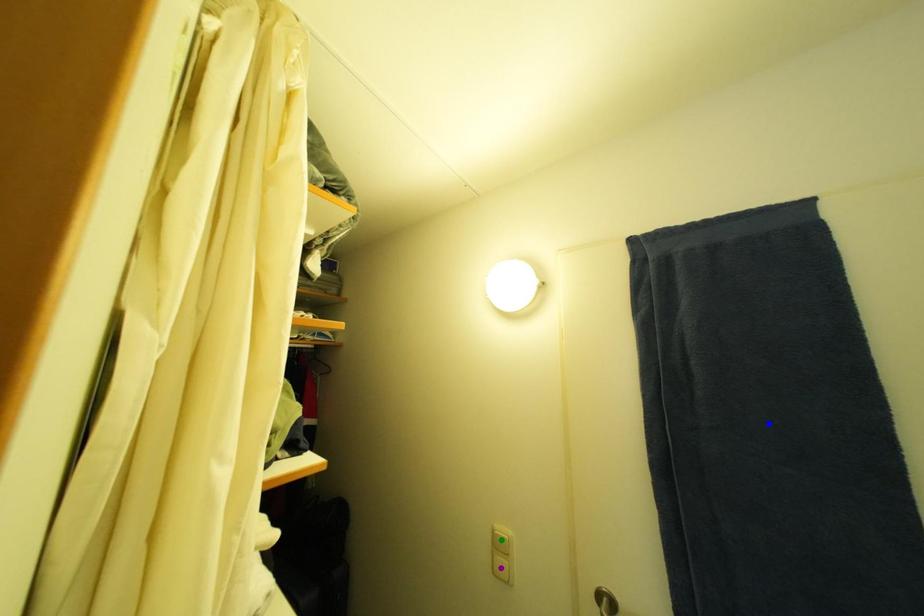
Based on the photo, order these from farthest to nearest:
blue point | green point | purple point

1. purple point
2. green point
3. blue point